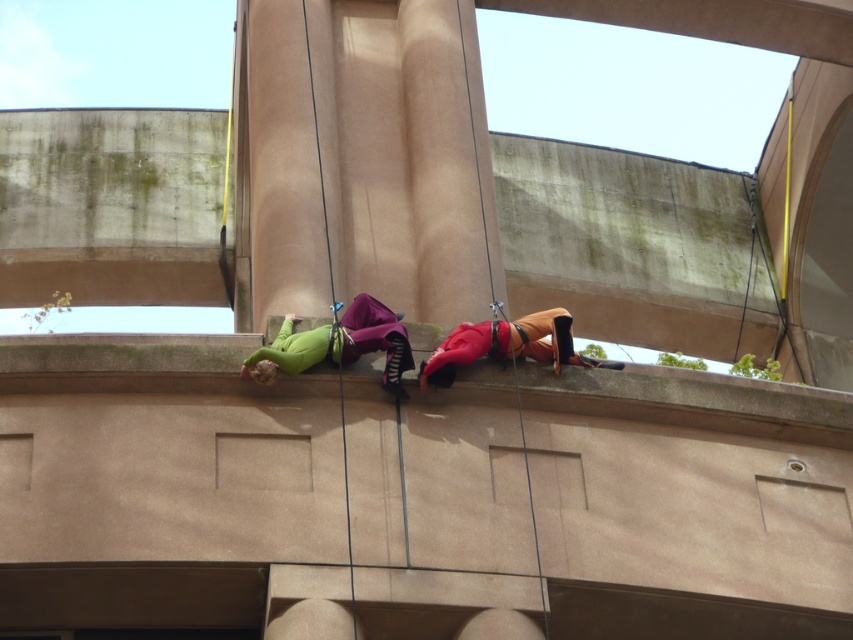
Between point (277, 369) and point (454, 328), which one is positioned behind?

The point (454, 328) is behind.

Between green matte/suede pants at center and orange fabric at center, which one appears on the right side from the viewer's perspective?

From the viewer's perspective, orange fabric at center appears more on the right side.

Does point (291, 332) come farther from viewer compared to point (447, 348)?

Yes, point (291, 332) is behind point (447, 348).

Find the location of a particular element. This screenshot has height=640, width=853. green matte/suede pants at center is located at coordinates (337, 344).